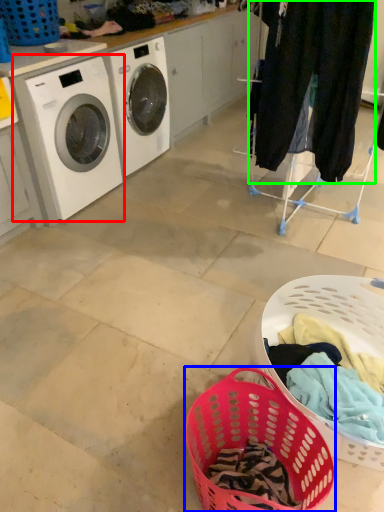
Question: Based on their relative distances, which object is farther from washing machine (highlighted by a red box)? Choose from basket (highlighted by a blue box) and clothing (highlighted by a green box).

Choices:
 (A) basket
 (B) clothing

Answer: (A)